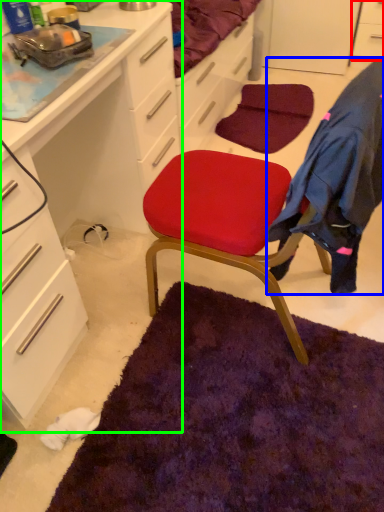
Question: Which object is positioned closest to cabinetry (highlighted by a red box)? Select from clothing (highlighted by a blue box) and cabinetry (highlighted by a green box).

Choices:
 (A) clothing
 (B) cabinetry

Answer: (B)